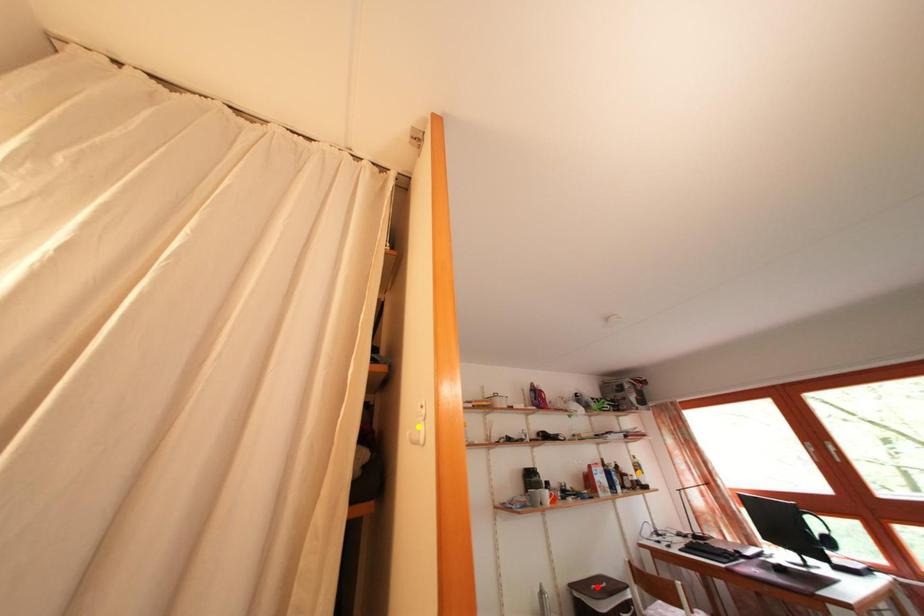
Order these from nearest to farthest:
1. yellow point
2. orange point
3. red point

yellow point, red point, orange point